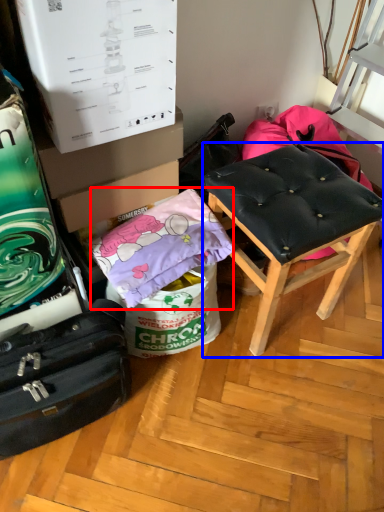
Question: Among these objects, which one is farthest to the camera, material (highlighted by a red box) or stool (highlighted by a blue box)?

Choices:
 (A) material
 (B) stool

Answer: (A)